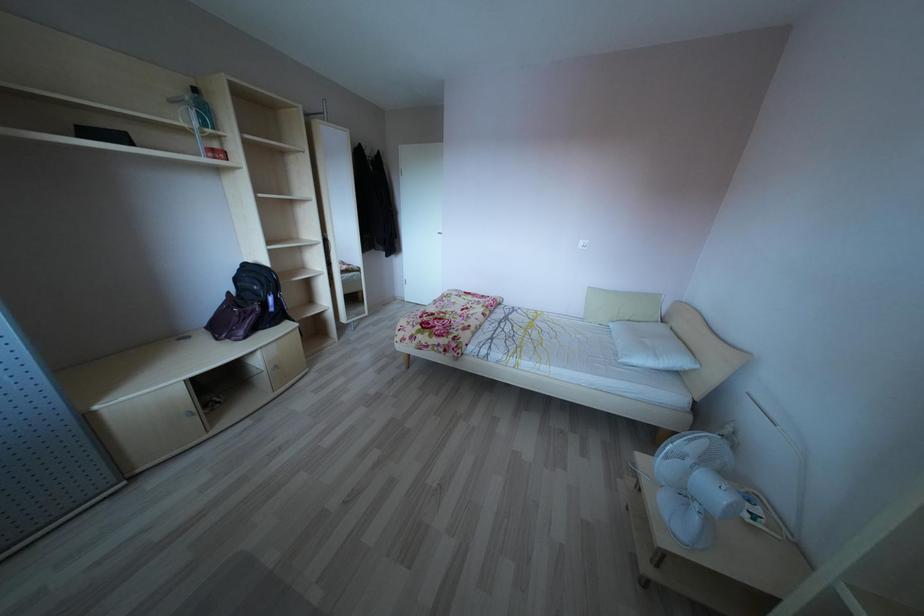
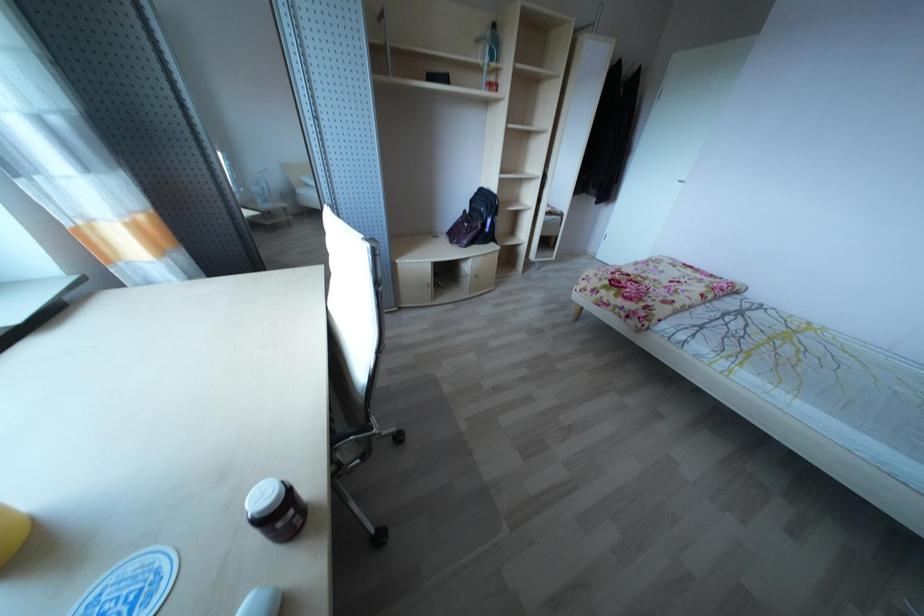
How did the camera likely rotate?

The camera rotated toward left-down.